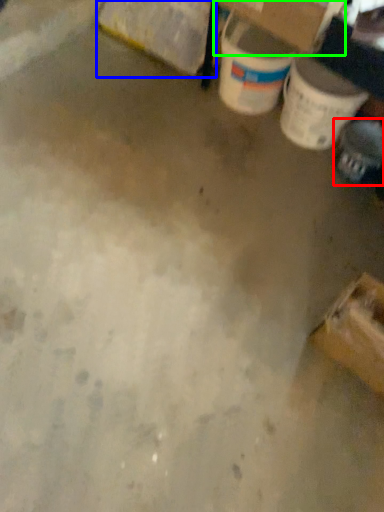
Question: Which object is positioned farthest from footwear (highlighted by a red box)? Select from cardboard box (highlighted by a blue box) and cardboard box (highlighted by a green box).

Choices:
 (A) cardboard box
 (B) cardboard box

Answer: (A)